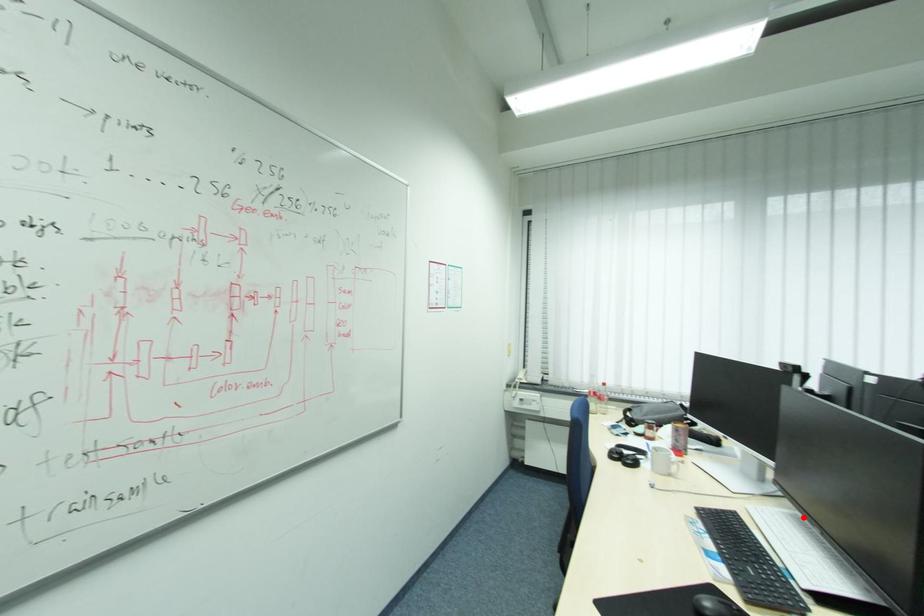
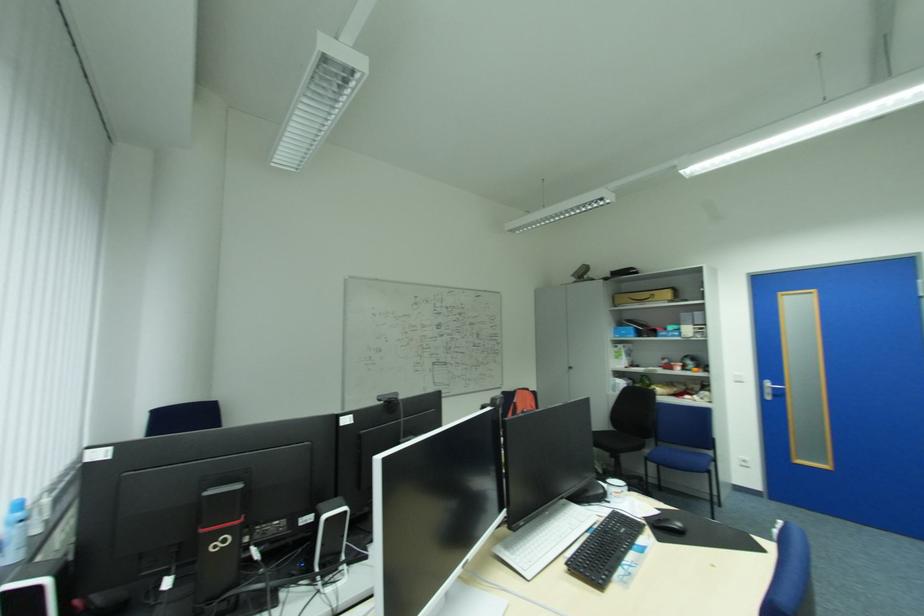
Where in the second image is the point corresponding to the highlighted location from the first image?

(514, 546)